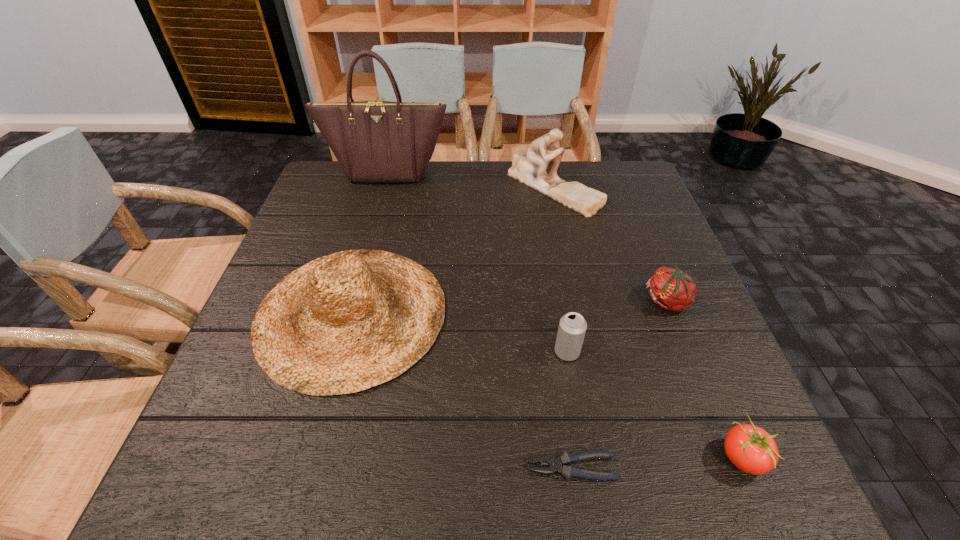
Find the location of a particular element. The height and width of the screenshot is (540, 960). the tallest object is located at coordinates (374, 141).

What are the coordinates of `the second tallest object` in the screenshot? It's located at (529, 167).

Where is `sunhat`? The image size is (960, 540). sunhat is located at coordinates (345, 322).

Locate an element on the screen. Image resolution: width=960 pixels, height=540 pixels. the fourth shortest object is located at coordinates (572, 327).

Locate an element on the screen. the farther tomato is located at coordinates (673, 290).

I want to click on the nearer tomato, so click(x=751, y=449).

Where is `the shortest object`? the shortest object is located at coordinates (568, 472).

Where is `free region located 0.370m on the front-facing side of the handbag`? Image resolution: width=960 pixels, height=540 pixels. free region located 0.370m on the front-facing side of the handbag is located at coordinates (359, 272).

Locate an element on the screen. This screenshot has width=960, height=540. vacant space situated on the front-facing side of the sixth shortest object is located at coordinates (566, 252).

The height and width of the screenshot is (540, 960). I want to click on vacant position located on the right of the fifth shortest object, so coord(584,313).